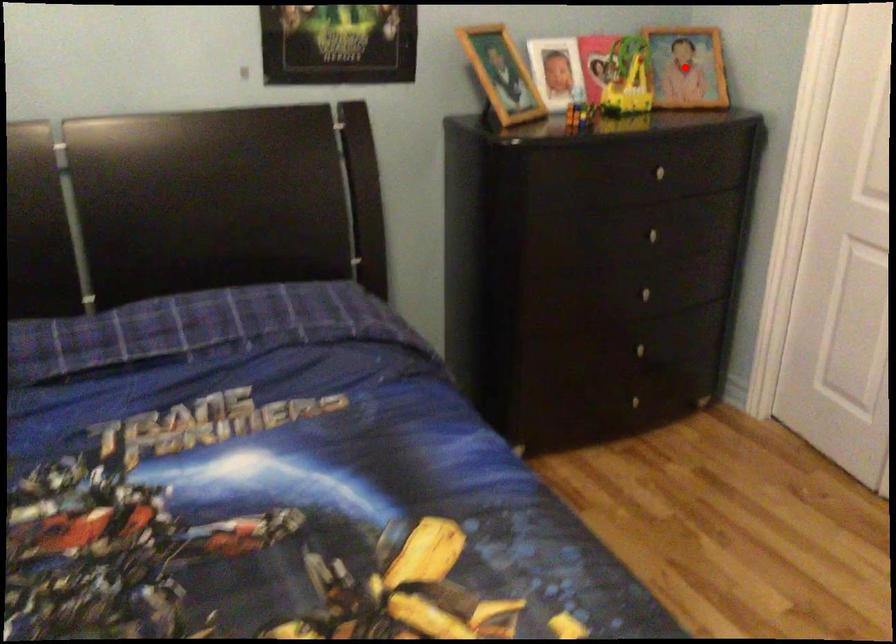
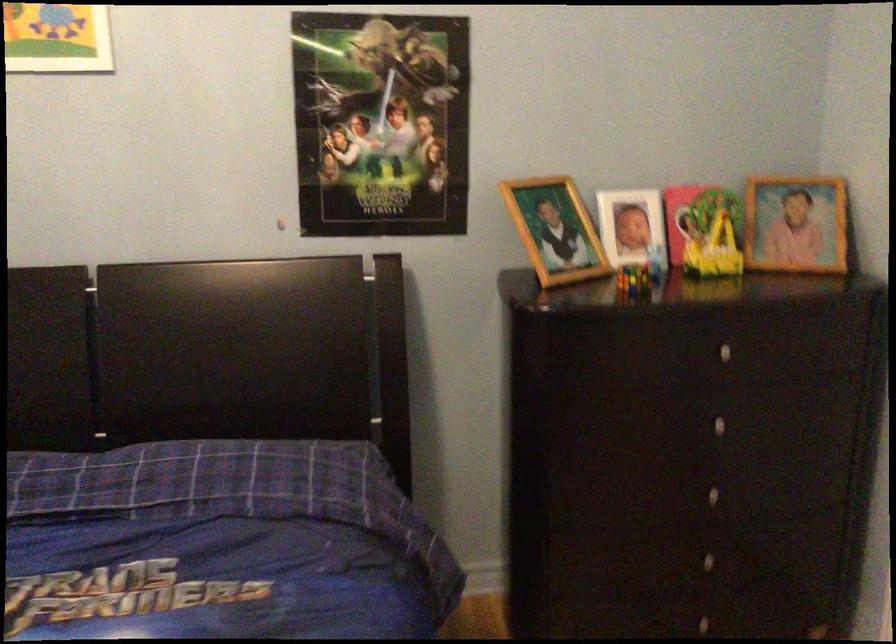
Question: I am providing you with two images of the same scene from different viewpoints. A red point is marked on the first image. At the location where the point appears in image 1, is it still visible in image 2?

Choices:
 (A) Yes
 (B) No

Answer: (A)